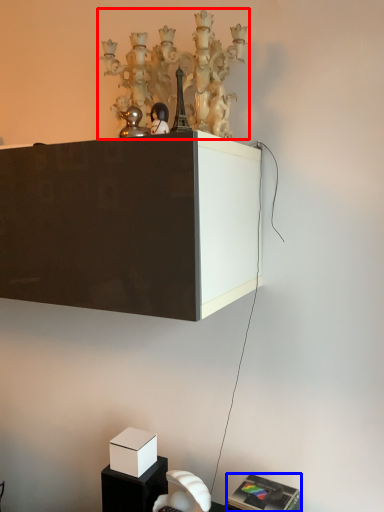
Question: Among these objects, which one is nearest to the camera, lamp (highlighted by a red box) or furniture (highlighted by a blue box)?

Choices:
 (A) lamp
 (B) furniture

Answer: (A)